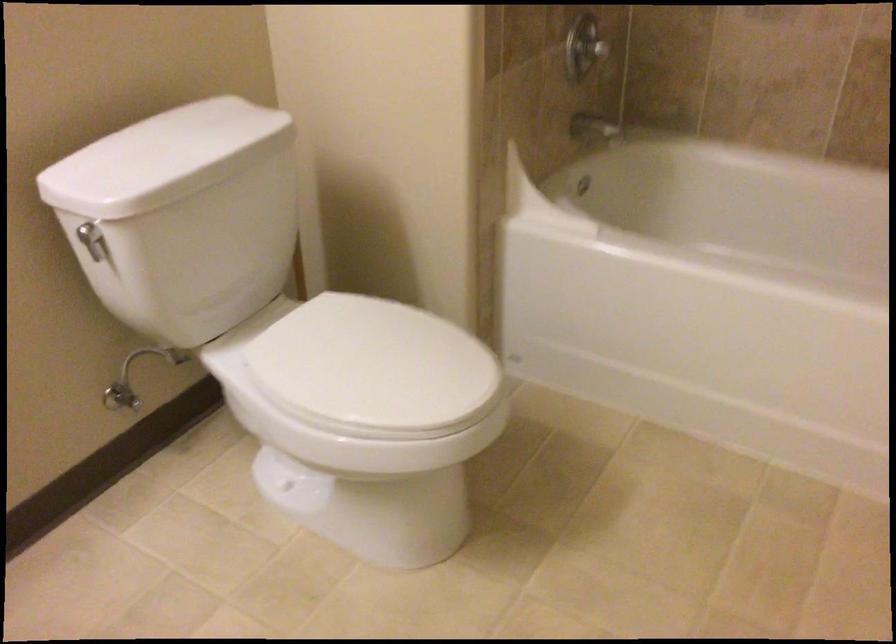
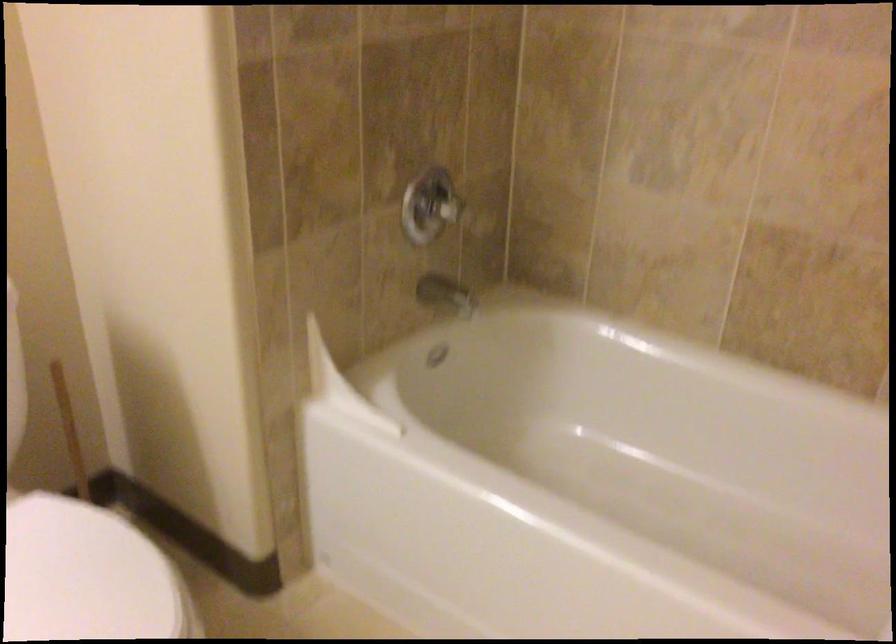
In the second image, find the point that corresponds to pixel 297 263 in the first image.

(72, 438)